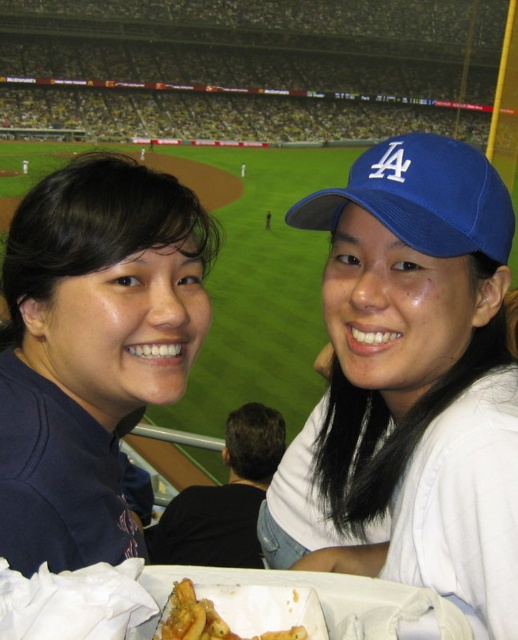
Does matte blue baseball cap at upper right appear under blue fabric baseball cap at upper right?

Correct, matte blue baseball cap at upper right is located below blue fabric baseball cap at upper right.

Between matte blue baseball cap at upper right and blue fabric baseball cap at upper right, which one appears on the right side from the viewer's perspective?

blue fabric baseball cap at upper right

What do you see at coordinates (92, 349) in the screenshot? Image resolution: width=518 pixels, height=640 pixels. I see `matte blue baseball cap at upper right` at bounding box center [92, 349].

The image size is (518, 640). In order to click on matte blue baseball cap at upper right in this screenshot , I will do `click(92, 349)`.

Between point (380, 429) and point (479, 248), which one is positioned in front?

Point (479, 248) is more forward.

Which is more to the right, blue fabric cap at upper right or blue fabric baseball cap at upper right?

blue fabric cap at upper right

The image size is (518, 640). I want to click on blue fabric cap at upper right, so click(410, 385).

Locate an element on the screen. blue fabric cap at upper right is located at coordinates (410, 385).

Is matte blue baseball cap at upper right in front of golden crispy fries at lower center?

No, matte blue baseball cap at upper right is further to the viewer.

Is matte blue baseball cap at upper right shorter than golden crispy fries at lower center?

No.

Is point (94, 300) closer to camera compared to point (217, 637)?

No, it is behind (217, 637).

Locate an element on the screen. matte blue baseball cap at upper right is located at coordinates (92, 349).